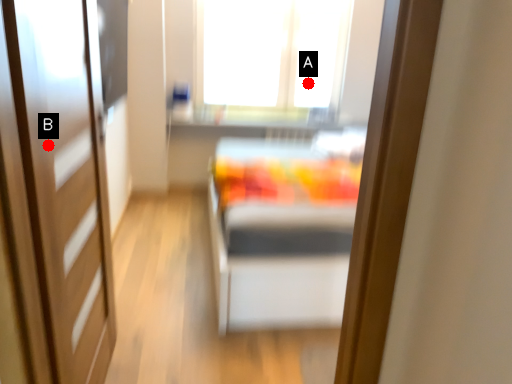
Question: Two points are circled on the image, labeled by A and B beside each circle. Which point is further to the camera?

Choices:
 (A) A is further
 (B) B is further

Answer: (A)